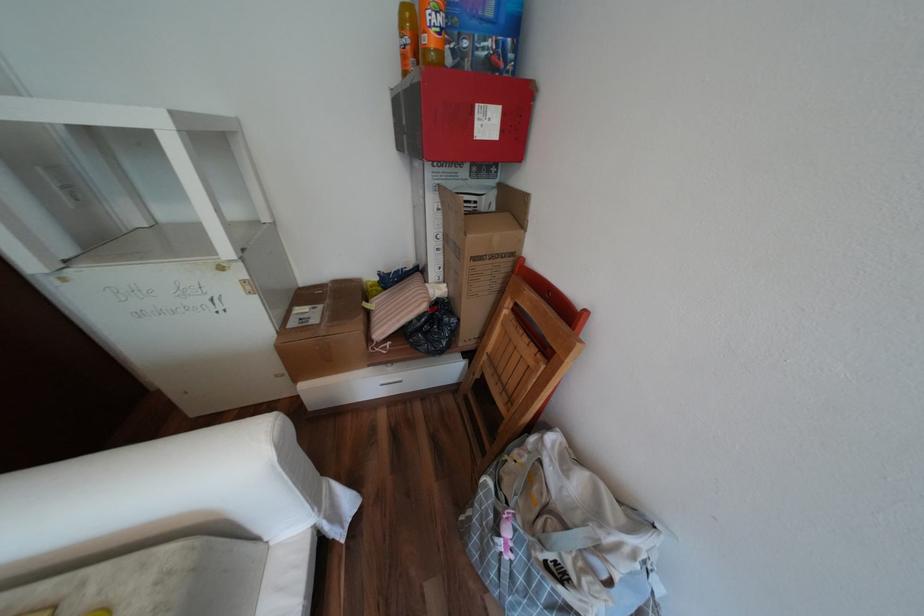
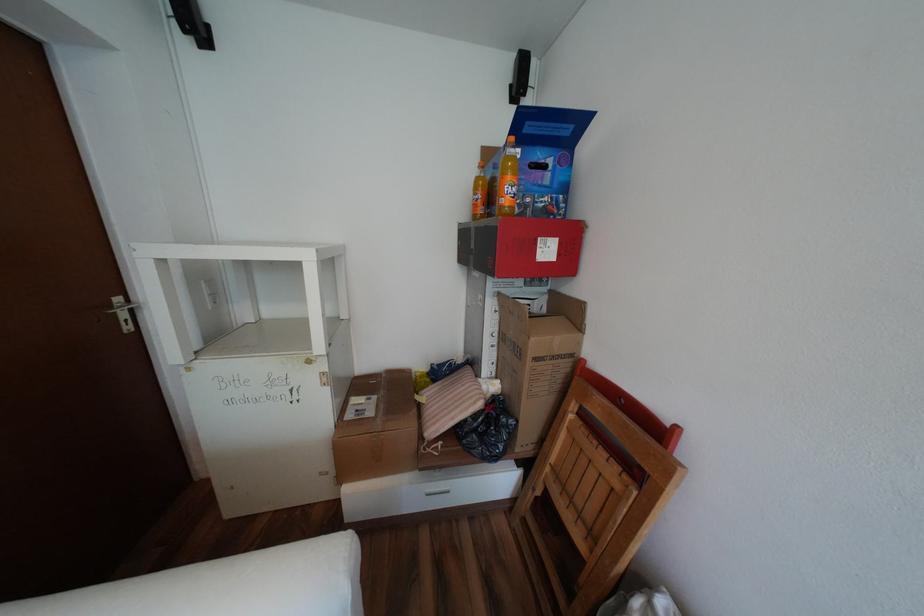
In the second image, find the point that corresponds to pixel 412 57 in the first image.

(484, 206)